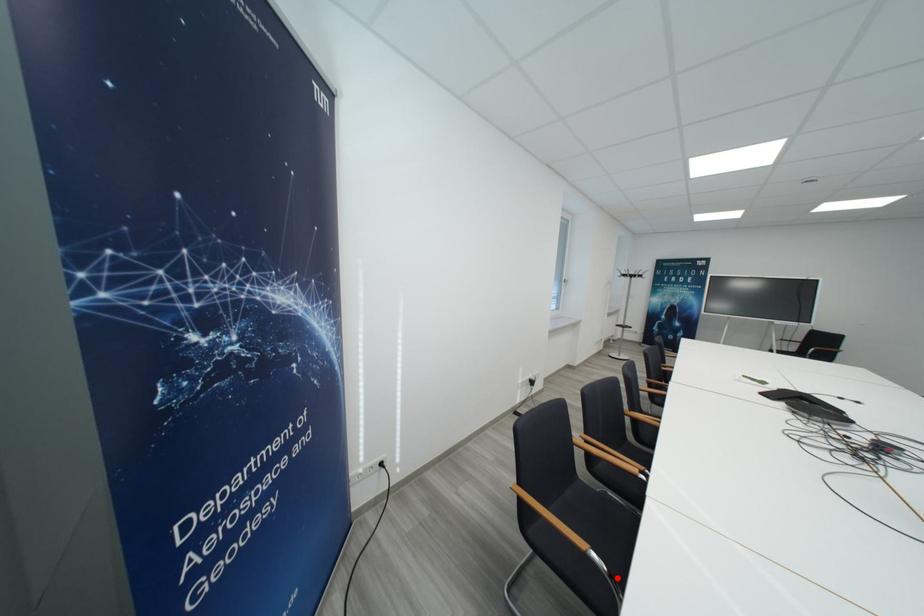
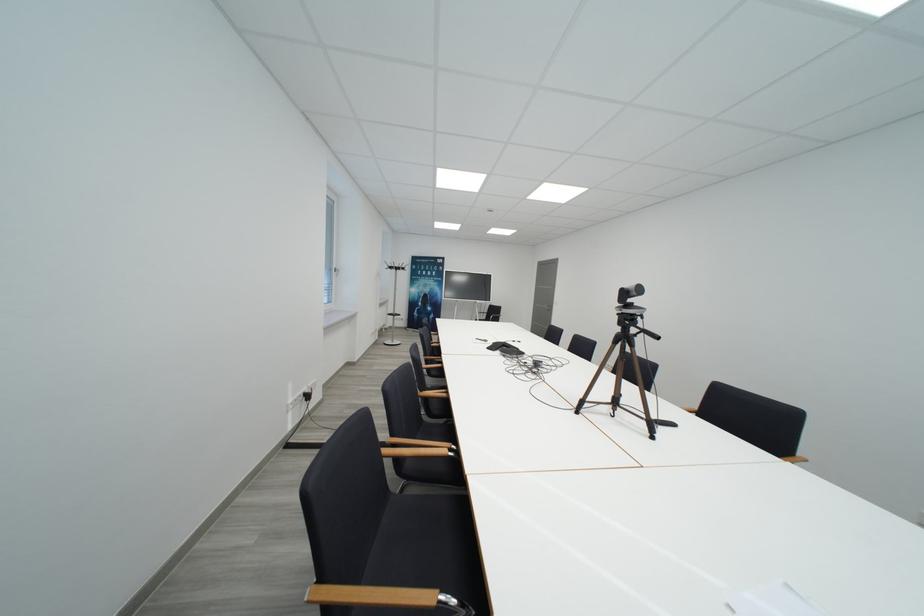
Question: I am providing you with two images of the same scene from different viewpoints. Image1 has a red point marked. In image2, the corresponding 3D location appears at what relative position? Reply with the corresponding letter.

Choices:
 (A) Closer
 (B) Farther

Answer: (A)